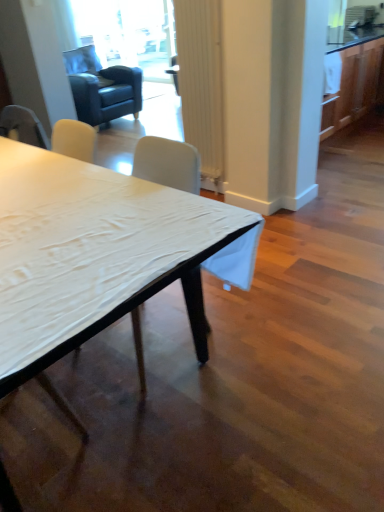
The width and height of the screenshot is (384, 512). What do you see at coordinates (129, 33) in the screenshot?
I see `transparent glass door at upper center` at bounding box center [129, 33].

This screenshot has width=384, height=512. Describe the element at coordinates (201, 80) in the screenshot. I see `white ribbed curtain at center` at that location.

The height and width of the screenshot is (512, 384). Find the location of `dark blue leather swivel chair at upper left`. dark blue leather swivel chair at upper left is located at coordinates (102, 87).

Image resolution: width=384 pixels, height=512 pixels. What are the coordinates of `white fabric chair at center` in the screenshot? It's located at (167, 163).

Is white matte table at center outside of dark blue leather swivel chair at upper left?

Yes, white matte table at center is outside of dark blue leather swivel chair at upper left.

Between white matte table at center and dark blue leather swivel chair at upper left, which one has smaller width?

white matte table at center is thinner.

In the scene shown: Does white matte table at center turn towards dark blue leather swivel chair at upper left?

No, white matte table at center is not oriented towards dark blue leather swivel chair at upper left.

How different are the orientations of white matte table at center and dark blue leather swivel chair at upper left in degrees?

There is a 86.5-degree angle between the facing directions of white matte table at center and dark blue leather swivel chair at upper left.

Does point (82, 150) come in front of point (196, 13)?

Yes, it is in front of point (196, 13).

Is white fabric chair at center thinner than white ribbed curtain at center?

Incorrect, the width of white fabric chair at center is not less than that of white ribbed curtain at center.

Which of these two, white fabric chair at center or white ribbed curtain at center, stands shorter?

white ribbed curtain at center.

Which object is positioned more to the right, white ribbed curtain at center or transparent glass door at upper center?

white ribbed curtain at center is more to the right.

From a real-world perspective, who is located lower, white ribbed curtain at center or transparent glass door at upper center?

transparent glass door at upper center, from a real-world perspective.

Does white ribbed curtain at center contain transparent glass door at upper center?

No, transparent glass door at upper center is located outside of white ribbed curtain at center.

From their relative heights in the image, would you say white ribbed curtain at center is taller or shorter than transparent glass door at upper center?

In the image, white ribbed curtain at center appears to be shorter than transparent glass door at upper center.

Choose the correct answer: Is white ribbed curtain at center inside white fabric chair at center or outside it?

The correct answer is: outside.

Considering the relative sizes of white ribbed curtain at center and white fabric chair at center in the image provided, is white ribbed curtain at center taller than white fabric chair at center?

Incorrect, the height of white ribbed curtain at center is not larger of that of white fabric chair at center.

Which point is more distant from viewer, (194, 139) or (141, 390)?

The point (194, 139) is farther.

I want to click on curtain that is above the white fabric chair at center (from a real-world perspective), so click(x=201, y=80).

Is dark blue leather swivel chair at upper left completely or partially outside of white fabric chair at center?

Yes, dark blue leather swivel chair at upper left is located beyond the bounds of white fabric chair at center.

Does dark blue leather swivel chair at upper left have a lesser height compared to white fabric chair at center?

No, dark blue leather swivel chair at upper left is not shorter than white fabric chair at center.

Which is in front, dark blue leather swivel chair at upper left or white fabric chair at center?

Positioned in front is white fabric chair at center.

From the picture: From the image's perspective, which is below, dark blue leather swivel chair at upper left or white fabric chair at center?

white fabric chair at center appears lower in the image.

Is white matte table at center next to white fabric chair at center?

No, white matte table at center is not with white fabric chair at center.

Between white matte table at center and white fabric chair at center, which one is positioned in front?

white matte table at center is more forward.

From a real-world perspective, between white matte table at center and white fabric chair at center, who is vertically higher?

From a 3D spatial view, white fabric chair at center is above.

What's the angular difference between white matte table at center and white fabric chair at center's facing directions?

179 degrees.

From a real-world perspective, is dark blue leather swivel chair at upper left on white matte table at center?

Correct, in the physical world, dark blue leather swivel chair at upper left is higher than white matte table at center.

Does dark blue leather swivel chair at upper left appear on the left side of white matte table at center?

Correct, you'll find dark blue leather swivel chair at upper left to the left of white matte table at center.

Is dark blue leather swivel chair at upper left shorter than white matte table at center?

No, dark blue leather swivel chair at upper left is not shorter than white matte table at center.

Find the location of `swivel chair behind the white matte table at center`. swivel chair behind the white matte table at center is located at coordinates (102, 87).

This screenshot has width=384, height=512. In the image, there is a white ribbed curtain at center. What are the coordinates of `chair below it (from a real-world perspective)` in the screenshot? It's located at (167, 163).

Estimate the real-world distances between objects in this image. Which object is further from white ribbed curtain at center, white fabric chair at center or white matte table at center?

white matte table at center is further to white ribbed curtain at center.

Considering their positions, is dark blue leather swivel chair at upper left positioned further to white fabric chair at center than white ribbed curtain at center?

The object further to white fabric chair at center is dark blue leather swivel chair at upper left.

When comparing their distances from transparent glass door at upper center, does white ribbed curtain at center or white matte table at center seem closer?

Among the two, white ribbed curtain at center is located nearer to transparent glass door at upper center.

From the image, which object appears to be nearer to dark blue leather swivel chair at upper left, white matte table at center or white ribbed curtain at center?

white ribbed curtain at center lies closer to dark blue leather swivel chair at upper left than the other object.

Which object lies further to the anchor point transparent glass door at upper center, white matte table at center or dark blue leather swivel chair at upper left?

white matte table at center is positioned further to the anchor transparent glass door at upper center.

Which object lies nearer to the anchor point white matte table at center, white ribbed curtain at center or transparent glass door at upper center?

Among the two, white ribbed curtain at center is located nearer to white matte table at center.

Looking at this image, based on their spatial positions, is transparent glass door at upper center or white ribbed curtain at center further from white fabric chair at center?

The object further to white fabric chair at center is transparent glass door at upper center.

Considering their positions, is white ribbed curtain at center positioned closer to white matte table at center than dark blue leather swivel chair at upper left?

white ribbed curtain at center is closer to white matte table at center.

At what (x,y) coordinates should I click in order to perform the action: click on curtain between white matte table at center and transparent glass door at upper center along the z-axis. Please return your answer as a coordinate pair (x, y). This screenshot has width=384, height=512. Looking at the image, I should click on (201, 80).

This screenshot has height=512, width=384. In order to click on swivel chair between white ribbed curtain at center and transparent glass door at upper center from front to back in this screenshot , I will do `click(102, 87)`.

Where is `chair located between white matte table at center and dark blue leather swivel chair at upper left in the depth direction`? The image size is (384, 512). chair located between white matte table at center and dark blue leather swivel chair at upper left in the depth direction is located at coordinates (167, 163).

Where is `curtain located between white matte table at center and dark blue leather swivel chair at upper left in the depth direction`? curtain located between white matte table at center and dark blue leather swivel chair at upper left in the depth direction is located at coordinates (201, 80).